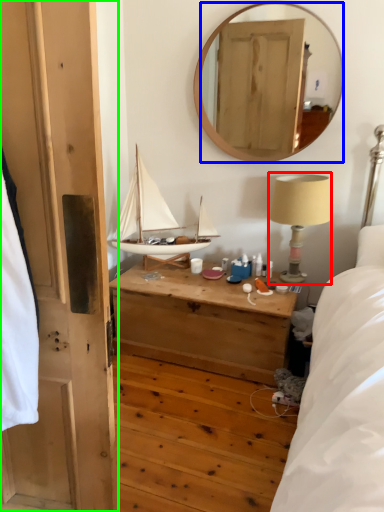
Question: Which is farther away from table lamp (highlighted by a red box)? mirror (highlighted by a blue box) or door (highlighted by a green box)?

Choices:
 (A) mirror
 (B) door

Answer: (A)